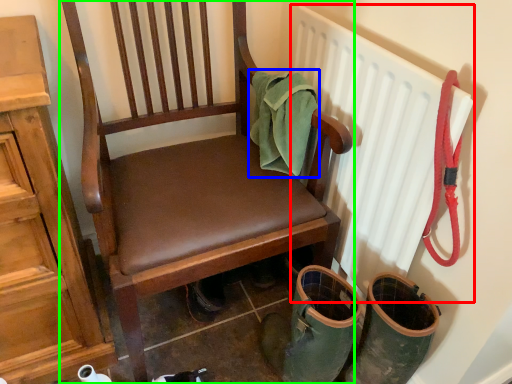
Question: Which is nearer to the radiator (highlighted by a red box)? material (highlighted by a blue box) or chair (highlighted by a green box).

Choices:
 (A) material
 (B) chair

Answer: (A)